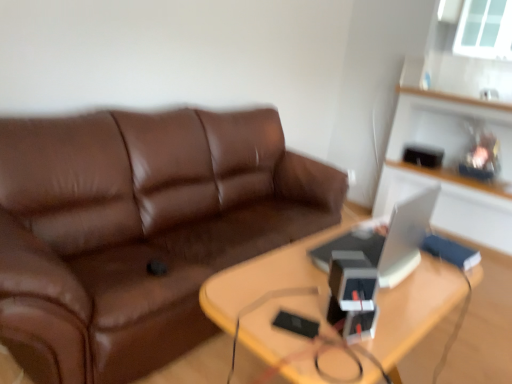
Question: Considering the positions of point (421, 200) and point (326, 240), is point (421, 200) closer or farther from the camera than point (326, 240)?

Choices:
 (A) farther
 (B) closer

Answer: (B)

Question: Based on their positions, is white glossy computer at right located to the left or right of wooden table at center?

Choices:
 (A) left
 (B) right

Answer: (B)

Question: Estimate the real-world distances between objects in this image. Which object is farther from the transparent glass window at upper right?

Choices:
 (A) wooden table at center
 (B) white glossy computer at right
 (C) brown leather couch at center

Answer: (A)

Question: Estimate the real-world distances between objects in this image. Which object is farther from the brown leather couch at center?

Choices:
 (A) wooden table at center
 (B) white glossy computer at right
 (C) transparent glass window at upper right

Answer: (C)